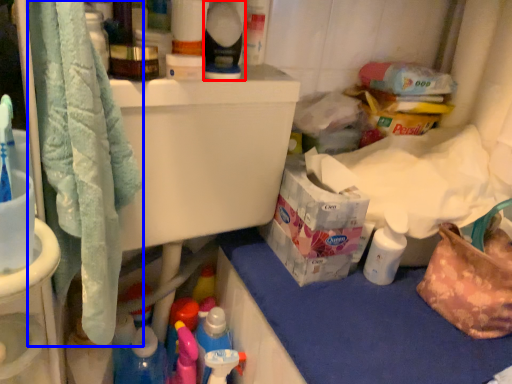
Question: Which point is closer to the camera, cleaning product (highlighted by a red box) or bath towel (highlighted by a blue box)?

Choices:
 (A) cleaning product
 (B) bath towel

Answer: (B)